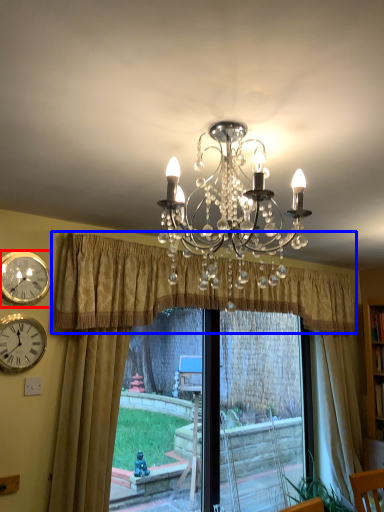
Question: Which of the following is the closest to the observer, wall clock (highlighted by a red box) or curtain (highlighted by a blue box)?

Choices:
 (A) wall clock
 (B) curtain

Answer: (B)